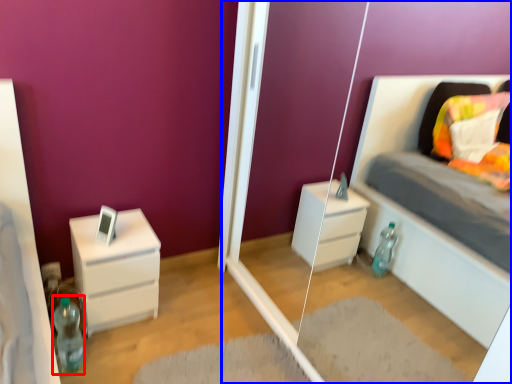
Question: Among these objects, which one is nearest to the camera, bottle (highlighted by a red box) or glass door (highlighted by a blue box)?

Choices:
 (A) bottle
 (B) glass door

Answer: (B)